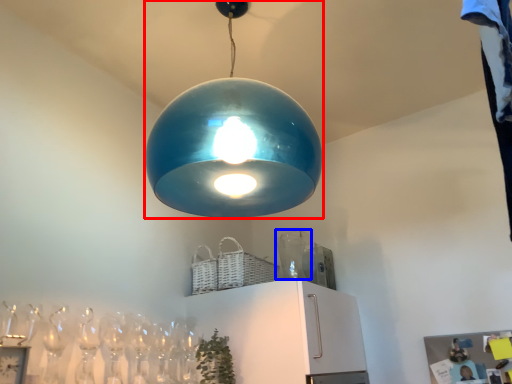
Question: Which object is further to the camera taking this photo, lamp (highlighted by a red box) or glass vase (highlighted by a blue box)?

Choices:
 (A) lamp
 (B) glass vase

Answer: (B)